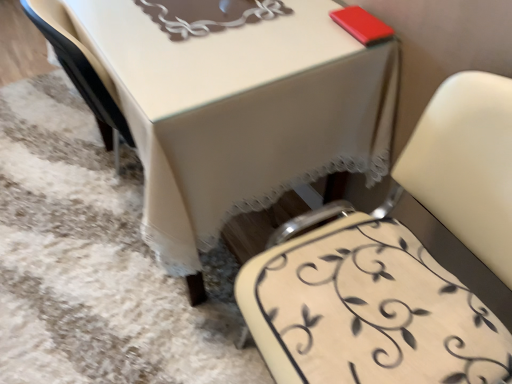
Question: Would you say white lace tablecloth at center is outside creamy leather chair at lower right?

Choices:
 (A) no
 (B) yes

Answer: (B)

Question: Is there a large distance between white lace tablecloth at center and creamy leather chair at lower right?

Choices:
 (A) yes
 (B) no

Answer: (B)

Question: From a real-world perspective, is white lace tablecloth at center positioned over creamy leather chair at lower right based on gravity?

Choices:
 (A) yes
 (B) no

Answer: (B)

Question: Would you say white lace tablecloth at center contains creamy leather chair at lower right?

Choices:
 (A) yes
 (B) no

Answer: (B)

Question: Considering the relative sizes of white lace tablecloth at center and creamy leather chair at lower right in the image provided, is white lace tablecloth at center bigger than creamy leather chair at lower right?

Choices:
 (A) yes
 (B) no

Answer: (A)

Question: Is white lace tablecloth at center thinner than creamy leather chair at lower right?

Choices:
 (A) no
 (B) yes

Answer: (A)

Question: Is creamy leather chair at lower right completely or partially inside white leather chair at center?

Choices:
 (A) no
 (B) yes

Answer: (B)

Question: Does white leather chair at center have a greater height compared to creamy leather chair at lower right?

Choices:
 (A) yes
 (B) no

Answer: (A)

Question: Is white leather chair at center far away from creamy leather chair at lower right?

Choices:
 (A) no
 (B) yes

Answer: (A)

Question: Can you confirm if white leather chair at center is wider than creamy leather chair at lower right?

Choices:
 (A) no
 (B) yes

Answer: (B)

Question: Is white leather chair at center shorter than creamy leather chair at lower right?

Choices:
 (A) no
 (B) yes

Answer: (A)

Question: From the image's perspective, is white leather chair at center under creamy leather chair at lower right?

Choices:
 (A) yes
 (B) no

Answer: (A)

Question: Does white leather chair at center have a lesser width compared to white lace tablecloth at center?

Choices:
 (A) no
 (B) yes

Answer: (B)